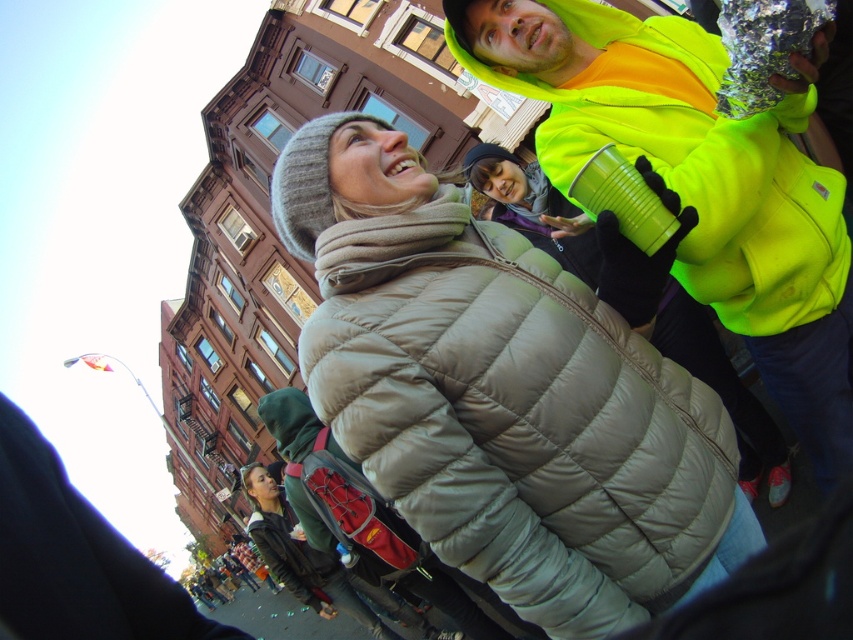
You are a photographer trying to capture a group photo of the matte gray puffer jacket at center and the dark green quilted jacket at lower left. Based on their positions in the image, which one should you focus on first to ensure they are both in the frame?

The matte gray puffer jacket at center is above the dark green quilted jacket at lower left, so you should focus on the dark green quilted jacket at lower left first to ensure both are in the frame.

Looking at this image, based on the scene description, which object is shorter in height between the neon yellow fleece at upper right and the dark green quilted jacket at lower left?

The neon yellow fleece at upper right is shorter in height than the dark green quilted jacket at lower left.

Based on the scene description, where is the matte gray puffer jacket at center located in the image?

The matte gray puffer jacket at center is located at point 0.653 on the x axis and 0.606 on the y axis.